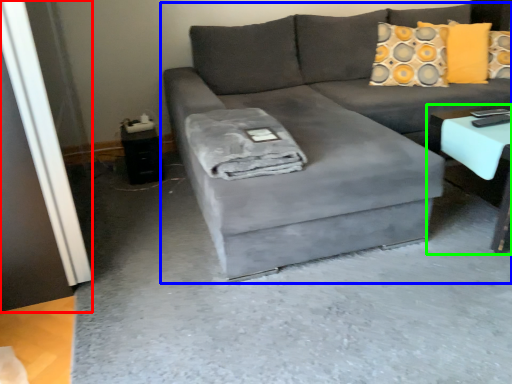
Question: Based on their relative distances, which object is nearer to glass door (highlighted by a red box)? Choose from studio couch (highlighted by a blue box) and table (highlighted by a green box).

Choices:
 (A) studio couch
 (B) table

Answer: (A)